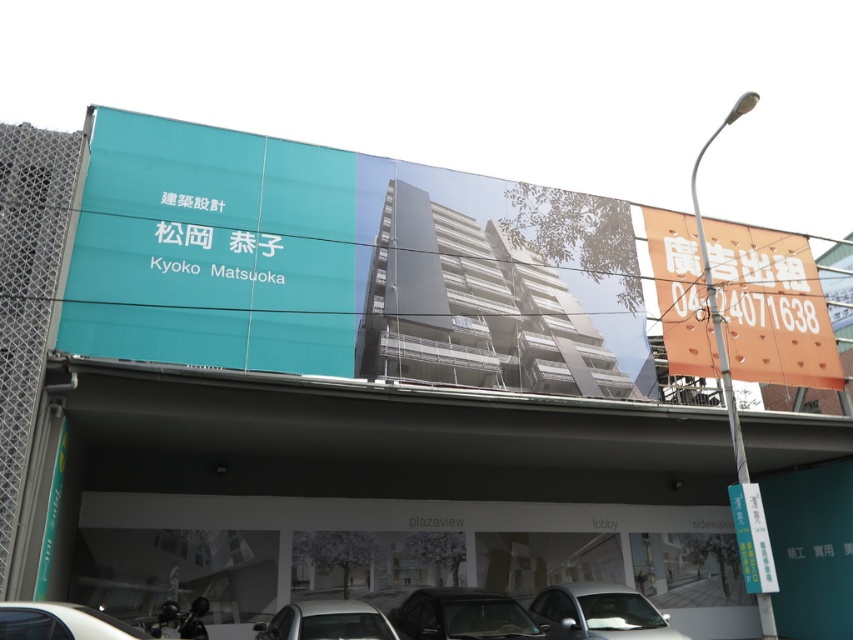
You are a photographer standing in front of the building. You want to capture a photo that includes both the teal matte signboard at upper left and the silver metallic car at lower center. Which object should you frame first to ensure both fit in the shot?

You should frame the teal matte signboard at upper left first because its width is greater than the silver metallic car at lower center, so ensuring it fits will automatically accommodate the narrower car.

You are standing in front of the building and notice two silver metallic cars. One is labeled as the silver metallic car at lower center and the other as the silver metallic car at center. From your perspective, which car is positioned to the right of the other?

The silver metallic car at lower center is to the right of the silver metallic car at center.